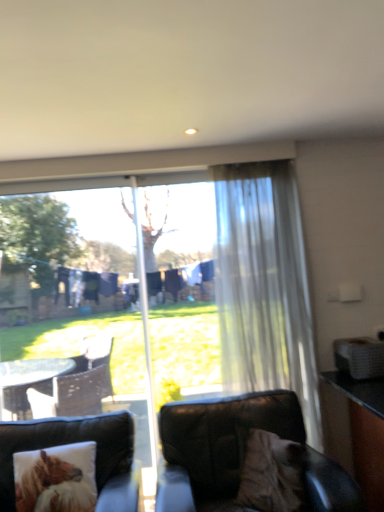
Question: Is fluffy brown pillow at lower left inside or outside of leather couch at lower left?

Choices:
 (A) outside
 (B) inside

Answer: (B)

Question: From the image's perspective, is fluffy brown pillow at lower left located above or below leather couch at lower left?

Choices:
 (A) below
 (B) above

Answer: (B)

Question: Which object is the closest to the translucent white curtain at right?

Choices:
 (A) black leather chair at lower right
 (B) beige fabric pillow at lower right
 (C) fluffy brown pillow at lower left
 (D) leather couch at lower left

Answer: (A)

Question: Which object is the closest to the fluffy brown pillow at lower left?

Choices:
 (A) beige fabric pillow at lower right
 (B) black leather chair at lower right
 (C) translucent white curtain at right
 (D) leather couch at lower left

Answer: (D)